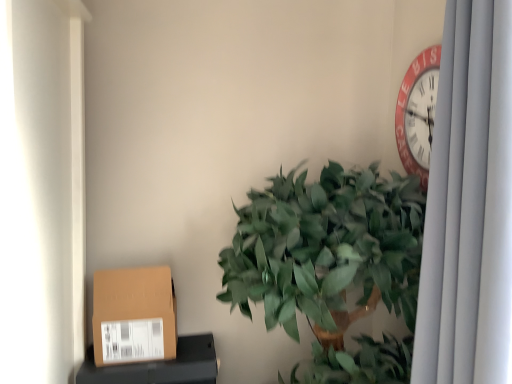
What do you see at coordinates (331, 262) in the screenshot?
I see `green leafy plant at center` at bounding box center [331, 262].

The width and height of the screenshot is (512, 384). What do you see at coordinates (134, 315) in the screenshot?
I see `brown cardboard box at lower left` at bounding box center [134, 315].

In order to face white fabric curtain at right, should I rotate leftwards or rightwards?

It's best to rotate right around 29.499 degrees.

Find the location of a particular element. The height and width of the screenshot is (384, 512). green leafy plant at center is located at coordinates (331, 262).

Considering the positions of objects brown cardboard box at lower left and brown cardboard box at lower left in the image provided, who is more to the left, brown cardboard box at lower left or brown cardboard box at lower left?

From the viewer's perspective, brown cardboard box at lower left appears more on the left side.

Between brown cardboard box at lower left and brown cardboard box at lower left, which one is positioned behind?

brown cardboard box at lower left.

From the image's perspective, is brown cardboard box at lower left located above or below brown cardboard box at lower left?

Clearly, from the image's perspective, brown cardboard box at lower left is above brown cardboard box at lower left.

Does brown cardboard box at lower left turn towards brown cardboard box at lower left?

No.

Could you tell me if white fabric curtain at right is turned towards brown cardboard box at lower left?

No, white fabric curtain at right is not turned towards brown cardboard box at lower left.

In the image, is white fabric curtain at right on the left side or the right side of brown cardboard box at lower left?

white fabric curtain at right is to the right of brown cardboard box at lower left.

Where is `furniture located underneath the white fabric curtain at right (from a real-world perspective)`? The image size is (512, 384). furniture located underneath the white fabric curtain at right (from a real-world perspective) is located at coordinates (159, 366).

Is white fabric curtain at right positioned before brown cardboard box at lower left?

Yes, white fabric curtain at right is closer to the camera.

Does brown cardboard box at lower left lie behind green leafy plant at center?

Yes, brown cardboard box at lower left is further from the viewer.

Considering the positions of point (173, 371) and point (280, 313), is point (173, 371) closer or farther from the camera than point (280, 313)?

Point (173, 371) is farther from the camera than point (280, 313).

Is brown cardboard box at lower left oriented away from green leafy plant at center?

No, brown cardboard box at lower left is not facing the opposite direction of green leafy plant at center.

Can you tell me how much brown cardboard box at lower left and green leafy plant at center differ in facing direction?

3.26 degrees separate the facing orientations of brown cardboard box at lower left and green leafy plant at center.

Is brown cardboard box at lower left positioned behind white fabric curtain at right?

Yes, it is behind white fabric curtain at right.

Which object is wider, brown cardboard box at lower left or white fabric curtain at right?

white fabric curtain at right.

Can you see brown cardboard box at lower left touching white fabric curtain at right?

No, brown cardboard box at lower left is not next to white fabric curtain at right.

Between brown cardboard box at lower left and white fabric curtain at right, which one has smaller size?

brown cardboard box at lower left.

Does point (167, 281) lie in front of point (455, 124)?

No.

Can you confirm if brown cardboard box at lower left is bigger than white fabric curtain at right?

No.

Is brown cardboard box at lower left beside white fabric curtain at right?

No, brown cardboard box at lower left is not with white fabric curtain at right.

From the image's perspective, relative to white fabric curtain at right, is brown cardboard box at lower left above or below?

brown cardboard box at lower left is below white fabric curtain at right.

Which object is wider, white fabric curtain at right or green leafy plant at center?

green leafy plant at center is wider.

From the picture: Is white fabric curtain at right taller or shorter than green leafy plant at center?

Considering their sizes, white fabric curtain at right has less height than green leafy plant at center.

From the image's perspective, which is above, white fabric curtain at right or green leafy plant at center?

white fabric curtain at right appears higher in the image.

Is green leafy plant at center behind brown cardboard box at lower left?

No, green leafy plant at center is in front of brown cardboard box at lower left.

Is green leafy plant at center not close to brown cardboard box at lower left?

No, there isn't a large distance between green leafy plant at center and brown cardboard box at lower left.

Choose the correct answer: Is green leafy plant at center inside brown cardboard box at lower left or outside it?

green leafy plant at center is outside brown cardboard box at lower left.

At what (x,y) coordinates should I click in order to perform the action: click on furniture below the brown cardboard box at lower left (from the image's perspective). Please return your answer as a coordinate pair (x, y). Looking at the image, I should click on (159, 366).

Locate an element on the screen. curtain located above the brown cardboard box at lower left (from a real-world perspective) is located at coordinates (469, 205).

From the picture: Looking at the image, which one is located further to green leafy plant at center, brown cardboard box at lower left or brown cardboard box at lower left?

brown cardboard box at lower left is further to green leafy plant at center.

Based on their spatial positions, is brown cardboard box at lower left or green leafy plant at center further from white fabric curtain at right?

Among the two, brown cardboard box at lower left is located further to white fabric curtain at right.

Considering their positions, is green leafy plant at center positioned further to brown cardboard box at lower left than brown cardboard box at lower left?

Based on the image, green leafy plant at center appears to be further to brown cardboard box at lower left.

Looking at the image, which one is located further to white fabric curtain at right, brown cardboard box at lower left or green leafy plant at center?

brown cardboard box at lower left is further to white fabric curtain at right.

Estimate the real-world distances between objects in this image. Which object is further from brown cardboard box at lower left, brown cardboard box at lower left or green leafy plant at center?

green leafy plant at center.

From the image, which object appears to be farther from white fabric curtain at right, green leafy plant at center or brown cardboard box at lower left?

The object further to white fabric curtain at right is brown cardboard box at lower left.

Based on their spatial positions, is green leafy plant at center or white fabric curtain at right further from brown cardboard box at lower left?

white fabric curtain at right is further to brown cardboard box at lower left.

Based on their spatial positions, is white fabric curtain at right or brown cardboard box at lower left closer to green leafy plant at center?

The object closer to green leafy plant at center is white fabric curtain at right.

What are the coordinates of `houseplant located between brown cardboard box at lower left and white fabric curtain at right in the left-right direction` in the screenshot? It's located at (331, 262).

You are a GUI agent. You are given a task and a screenshot of the screen. Output one action in this format:
    pyautogui.click(x=<x>, y=<y>)
    Task: Click on the furniture located between brown cardboard box at lower left and white fabric curtain at right in the left-right direction
    The width and height of the screenshot is (512, 384).
    Given the screenshot: What is the action you would take?
    pos(159,366)

Where is `houseplant located between brown cardboard box at lower left and white fabric curtain at right in the left-right direction`? The image size is (512, 384). houseplant located between brown cardboard box at lower left and white fabric curtain at right in the left-right direction is located at coordinates (331, 262).

Locate an element on the screen. This screenshot has width=512, height=384. furniture between green leafy plant at center and brown cardboard box at lower left along the z-axis is located at coordinates (159, 366).